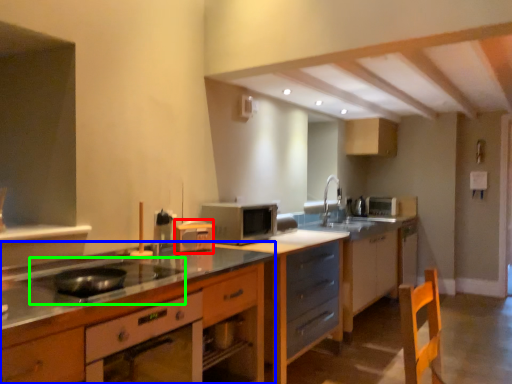
Question: Considering the real-world distances, which object is closest to appliance (highlighted by a red box)? cabinetry (highlighted by a blue box) or gas stove (highlighted by a green box).

Choices:
 (A) cabinetry
 (B) gas stove

Answer: (A)